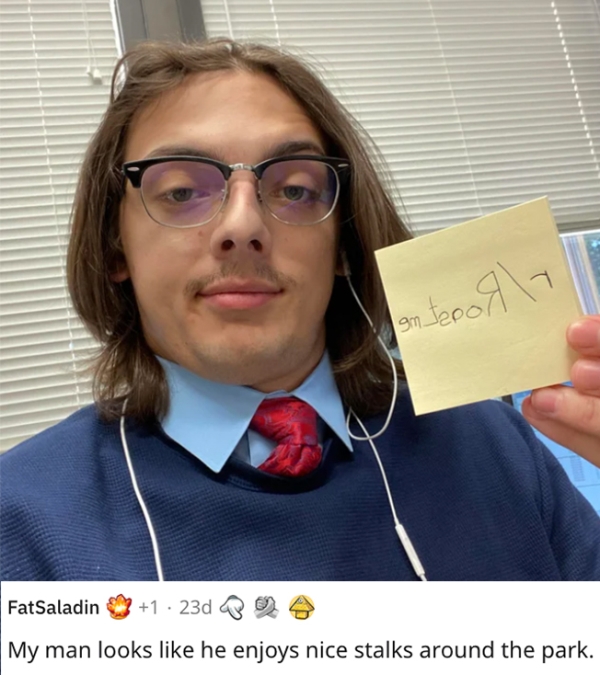
Find the location of `white blinds`. white blinds is located at coordinates (20, 405), (24, 302), (83, 354), (17, 36), (31, 136), (298, 7), (482, 16), (596, 44), (571, 182).